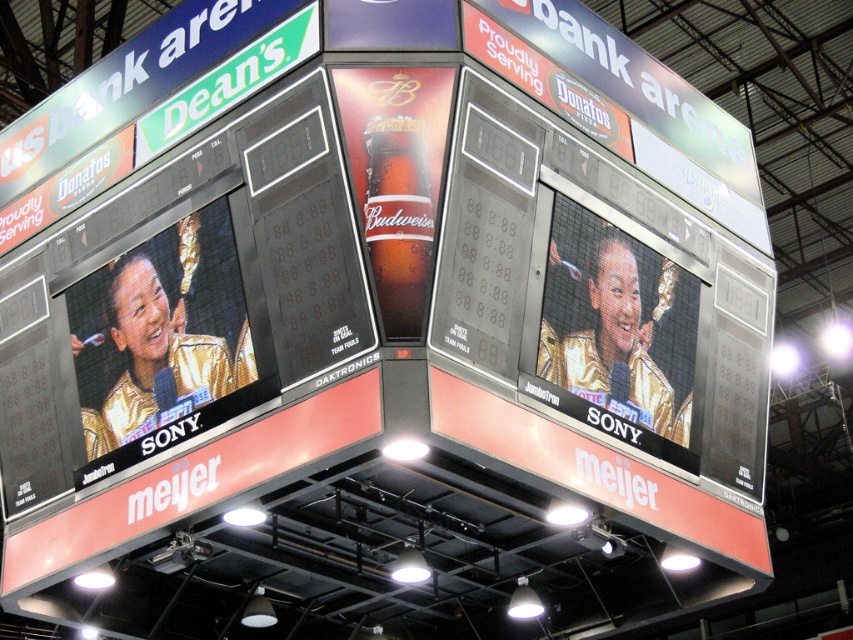
Based on the photo, is matte black screen at left bigger than matte gold screen at right?

Yes.

Is point (117, 436) less distant than point (625, 324)?

Yes, it is in front of point (625, 324).

Find the location of `matte black screen at left`. matte black screen at left is located at coordinates (167, 339).

Does shiny glass budweiser at center come behind green plastic sign at upper left?

No, it is not.

Between shiny glass budweiser at center and green plastic sign at upper left, which one appears on the left side from the viewer's perspective?

From the viewer's perspective, green plastic sign at upper left appears more on the left side.

Between point (357, 81) and point (0, 170), which one is positioned behind?

Point (0, 170)

This screenshot has width=853, height=640. What are the coordinates of `shiny glass budweiser at center` in the screenshot? It's located at (396, 179).

Who is more distant from viewer, (91, 115) or (384, 324)?

Positioned behind is point (91, 115).

Can you confirm if green plastic sign at upper left is smaller than bottle glass at center?

No.

What are the coordinates of `green plastic sign at upper left` in the screenshot? It's located at (128, 83).